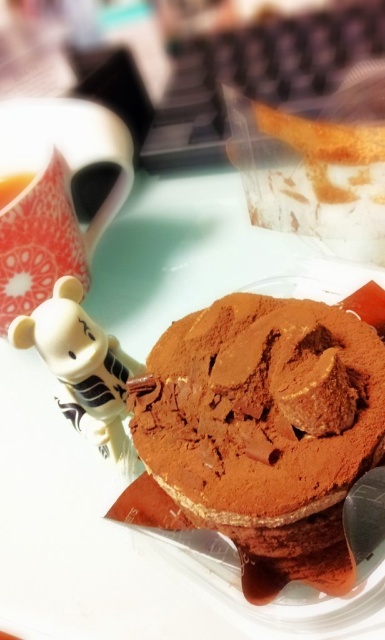
You are a photographer taking a close up shot of the desserts. You want to focus on the chocolatesmoothcake at center and matte white teacup at upper left. Which object should you adjust your camera focus to first to ensure it appears sharp in the photo?

The chocolatesmoothcake at center is closer to the viewer than the matte white teacup at upper left, so you should focus on the chocolatesmoothcake at center first to ensure it appears sharp in the photo.

You are setting up a table for a tea party and need to place the chocolatesmoothcake at center and the matte white teacup at upper left. The minimum distance required between them is 30 inches for proper spacing. Based on the image, will they meet the spacing requirement?

The chocolatesmoothcake at center is 28.79 inches from the matte white teacup at upper left, which is less than the required 30 inches. Therefore, they do not meet the spacing requirement.